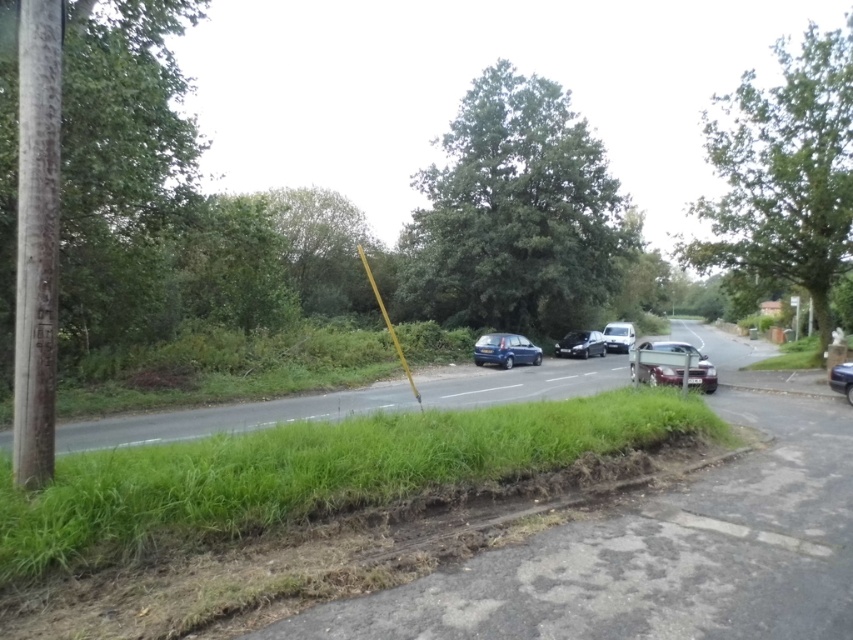
Which is more to the left, green grass at center or green leafy tree at center?

green grass at center is more to the left.

This screenshot has height=640, width=853. What are the coordinates of `green grass at center` in the screenshot? It's located at (660, 547).

What are the coordinates of `green grass at center` in the screenshot? It's located at (660, 547).

Is green grass at center closer to the viewer compared to green leafy tree at upper center?

Yes, it is in front of green leafy tree at upper center.

Is green grass at center bigger than green leafy tree at upper center?

Actually, green grass at center might be smaller than green leafy tree at upper center.

Describe the element at coordinates (660, 547) in the screenshot. Image resolution: width=853 pixels, height=640 pixels. I see `green grass at center` at that location.

Image resolution: width=853 pixels, height=640 pixels. In order to click on green grass at center in this screenshot , I will do `click(660, 547)`.

Does green grass at center appear on the left side of shiny silver car at center?

Correct, you'll find green grass at center to the left of shiny silver car at center.

Which of these two, green grass at center or shiny silver car at center, stands taller?

shiny silver car at center

Which is behind, point (624, 593) or point (625, 324)?

Positioned behind is point (625, 324).

Locate an element on the screen. The width and height of the screenshot is (853, 640). green grass at center is located at coordinates (660, 547).